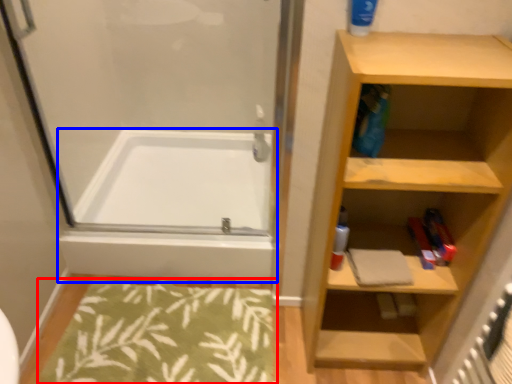
Question: Which point is further to the camera, bath mat (highlighted by a red box) or bathtub (highlighted by a blue box)?

Choices:
 (A) bath mat
 (B) bathtub

Answer: (B)